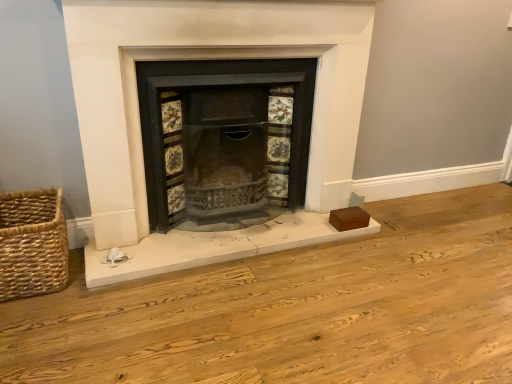
Question: Is matte black fireplace at center oriented away from woven straw basket at lower left?

Choices:
 (A) yes
 (B) no

Answer: (B)

Question: Would you say matte black fireplace at center is a long distance from woven straw basket at lower left?

Choices:
 (A) no
 (B) yes

Answer: (A)

Question: Considering the relative positions of matte black fireplace at center and woven straw basket at lower left in the image provided, is matte black fireplace at center behind woven straw basket at lower left?

Choices:
 (A) no
 (B) yes

Answer: (A)

Question: Is matte black fireplace at center oriented towards woven straw basket at lower left?

Choices:
 (A) no
 (B) yes

Answer: (A)

Question: From a real-world perspective, is matte black fireplace at center on top of woven straw basket at lower left?

Choices:
 (A) yes
 (B) no

Answer: (A)

Question: Is woven straw basket at lower left inside matte black fireplace at center?

Choices:
 (A) yes
 (B) no

Answer: (B)

Question: Considering the relative sizes of woven straw basket at lower left and black cast iron wood burning stove at center in the image provided, is woven straw basket at lower left wider than black cast iron wood burning stove at center?

Choices:
 (A) no
 (B) yes

Answer: (A)

Question: Does woven straw basket at lower left touch black cast iron wood burning stove at center?

Choices:
 (A) no
 (B) yes

Answer: (A)

Question: Could you tell me if woven straw basket at lower left is facing black cast iron wood burning stove at center?

Choices:
 (A) yes
 (B) no

Answer: (B)

Question: Is woven straw basket at lower left to the right of black cast iron wood burning stove at center from the viewer's perspective?

Choices:
 (A) yes
 (B) no

Answer: (B)

Question: Is woven straw basket at lower left to the left of black cast iron wood burning stove at center from the viewer's perspective?

Choices:
 (A) no
 (B) yes

Answer: (B)

Question: Would you say woven straw basket at lower left contains black cast iron wood burning stove at center?

Choices:
 (A) no
 (B) yes

Answer: (A)

Question: Does black cast iron wood burning stove at center touch woven straw basket at lower left?

Choices:
 (A) yes
 (B) no

Answer: (B)